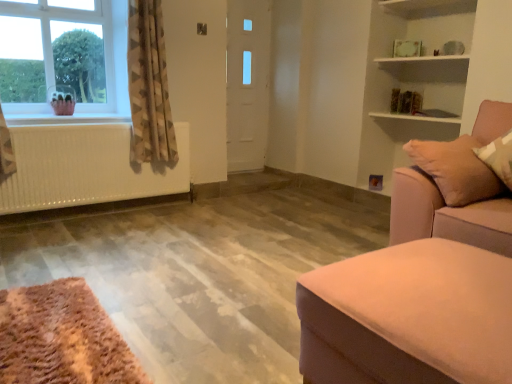
Question: From a real-world perspective, relative to white matte radiator at left, is beige textured curtain at left vertically above or below?

Choices:
 (A) above
 (B) below

Answer: (A)

Question: Is beige textured curtain at left inside the boundaries of white matte radiator at left, or outside?

Choices:
 (A) outside
 (B) inside

Answer: (A)

Question: Estimate the real-world distances between objects in this image. Which object is closer to the clear glass window at upper left?

Choices:
 (A) suede-like beige studio couch at right, which is the 1th studio couch from back to front
 (B) beige textured curtain at left
 (C) white glossy door at center
 (D) white matte radiator at left
 (E) suede-like pink ottoman at lower right, marked as the 1th studio couch in a front-to-back arrangement

Answer: (B)

Question: Estimate the real-world distances between objects in this image. Which object is closer to the clear glass window at upper left?

Choices:
 (A) white matte radiator at left
 (B) suede-like beige studio couch at right, which is the 1th studio couch from back to front
 (C) beige textured curtain at left
 (D) suede-like pink ottoman at lower right, marked as the 1th studio couch in a front-to-back arrangement
 (E) white glossy door at center

Answer: (C)